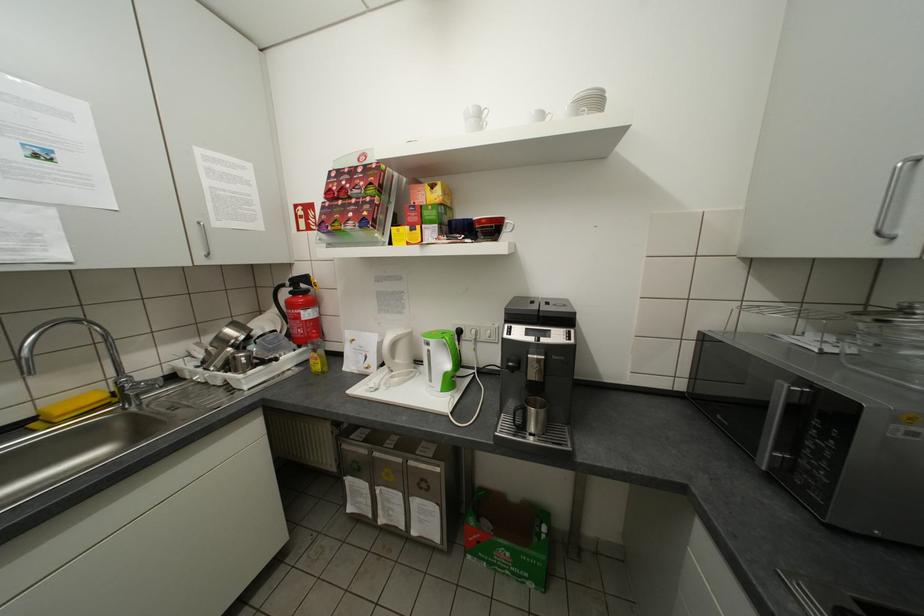
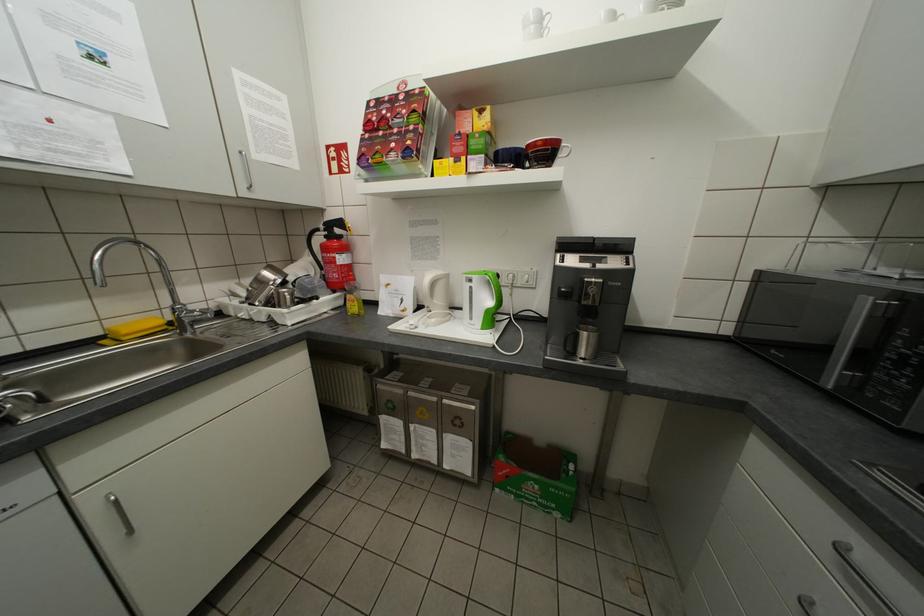
Locate, in the second image, the point that corresponds to (481,120) in the first image.

(541, 28)